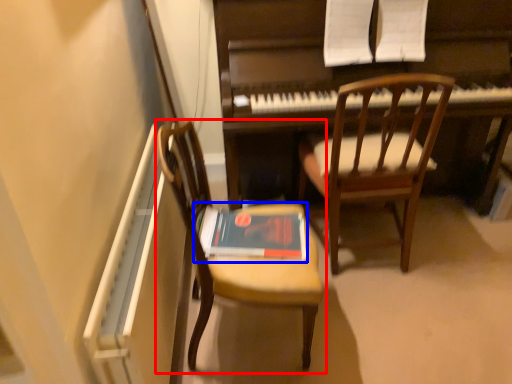
Question: Among these objects, which one is farthest to the camera, chair (highlighted by a red box) or paperback book (highlighted by a blue box)?

Choices:
 (A) chair
 (B) paperback book

Answer: (B)